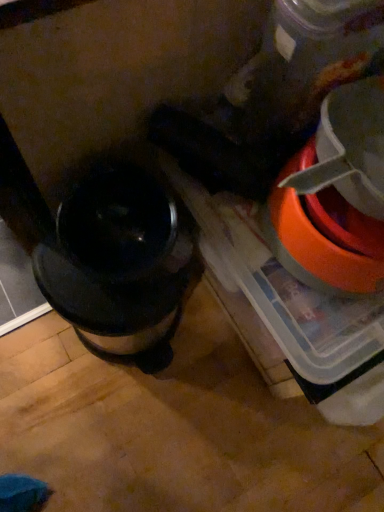
Question: Is orange plastic bowl at right at the right side of shiny metallic coffee maker at left?

Choices:
 (A) yes
 (B) no

Answer: (A)

Question: Considering the relative sizes of orange plastic bowl at right and shiny metallic coffee maker at left in the image provided, is orange plastic bowl at right bigger than shiny metallic coffee maker at left?

Choices:
 (A) no
 (B) yes

Answer: (A)

Question: Considering the relative sizes of orange plastic bowl at right and shiny metallic coffee maker at left in the image provided, is orange plastic bowl at right thinner than shiny metallic coffee maker at left?

Choices:
 (A) yes
 (B) no

Answer: (A)

Question: Is orange plastic bowl at right shorter than shiny metallic coffee maker at left?

Choices:
 (A) no
 (B) yes

Answer: (B)

Question: Is orange plastic bowl at right outside shiny metallic coffee maker at left?

Choices:
 (A) no
 (B) yes

Answer: (B)

Question: From a real-world perspective, is orange plastic bowl at right located higher than shiny metallic coffee maker at left?

Choices:
 (A) yes
 (B) no

Answer: (A)

Question: Is shiny metallic coffee maker at left facing towards orange plastic bowl at right?

Choices:
 (A) no
 (B) yes

Answer: (A)

Question: Can you confirm if shiny metallic coffee maker at left is taller than orange plastic bowl at right?

Choices:
 (A) no
 (B) yes

Answer: (B)

Question: Is shiny metallic coffee maker at left at the right side of orange plastic bowl at right?

Choices:
 (A) yes
 (B) no

Answer: (B)

Question: Is shiny metallic coffee maker at left looking in the opposite direction of orange plastic bowl at right?

Choices:
 (A) yes
 (B) no

Answer: (B)

Question: Would you consider shiny metallic coffee maker at left to be distant from orange plastic bowl at right?

Choices:
 (A) no
 (B) yes

Answer: (A)

Question: Considering the relative sizes of shiny metallic coffee maker at left and orange plastic bowl at right in the image provided, is shiny metallic coffee maker at left wider than orange plastic bowl at right?

Choices:
 (A) yes
 (B) no

Answer: (A)

Question: Is shiny metallic coffee maker at left in front of or behind orange plastic bowl at right in the image?

Choices:
 (A) front
 (B) behind

Answer: (B)